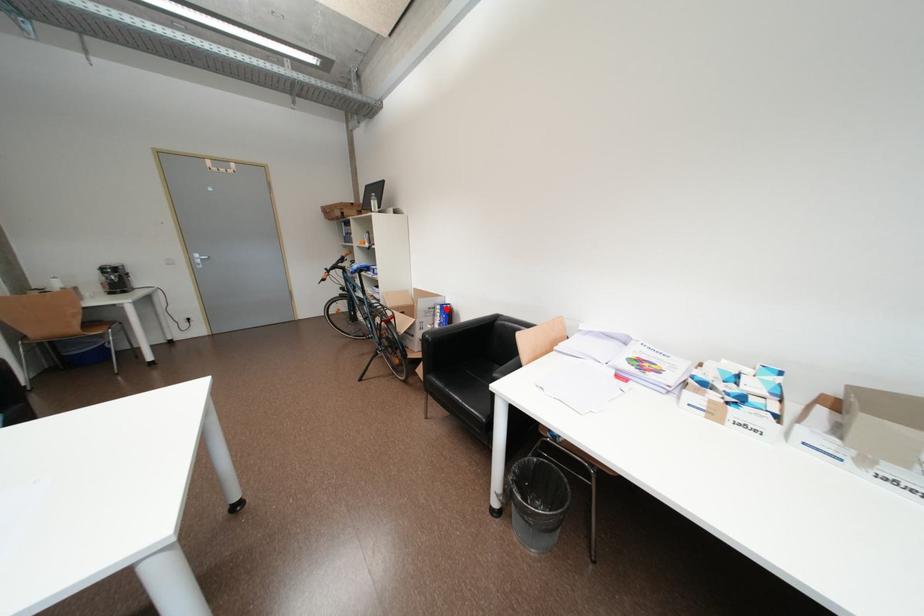
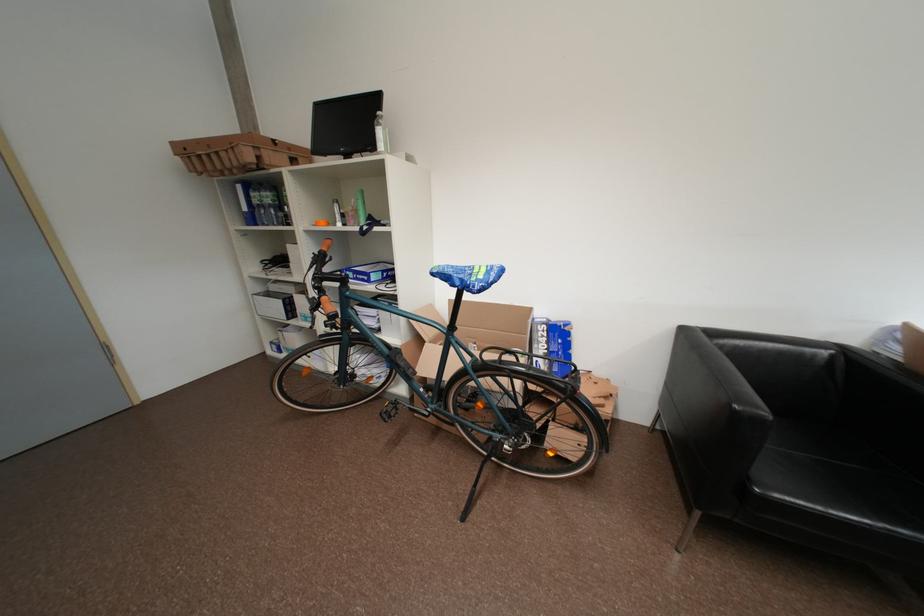
Question: I am providing you with two images of the same scene from different viewpoints. In image1, a red point is highlighted. Considering the same 3D point in image2, which of the following is correct?

Choices:
 (A) It is closer
 (B) It is farther

Answer: (B)